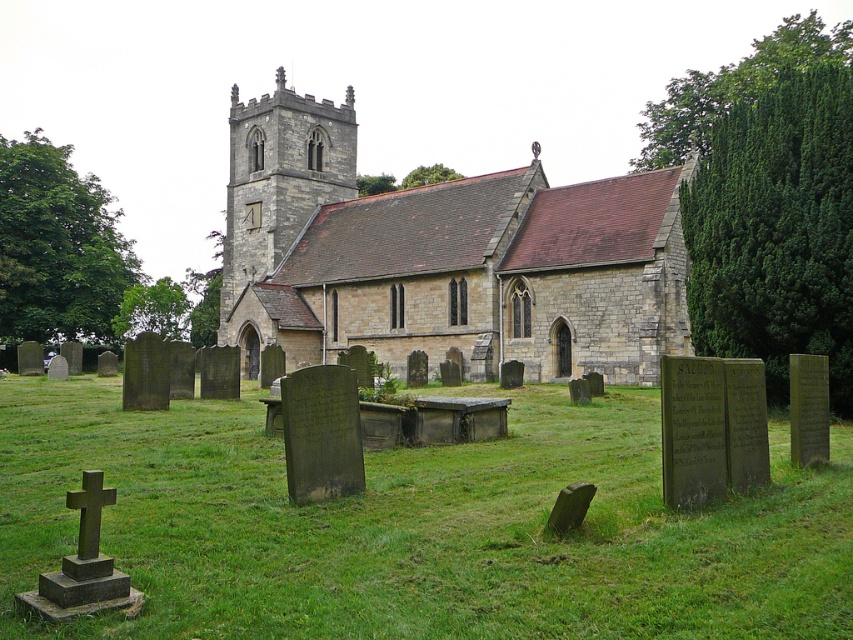
From the picture: Is green grass at center above stone church at center?

No.

Who is higher up, green grass at center or stone church at center?

stone church at center

Does point (642, 432) lie in front of point (410, 308)?

Yes, it is in front of point (410, 308).

This screenshot has height=640, width=853. I want to click on green grass at center, so click(x=416, y=525).